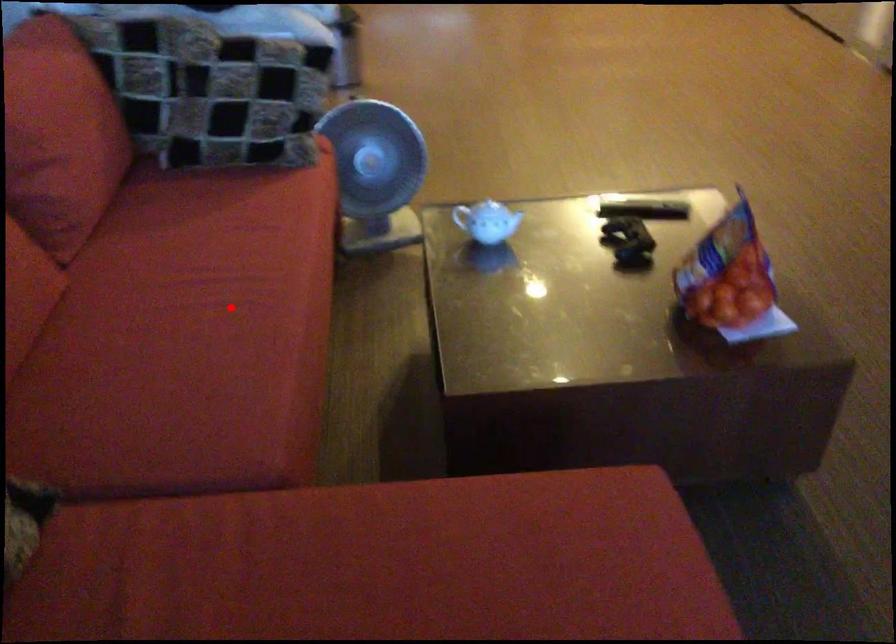
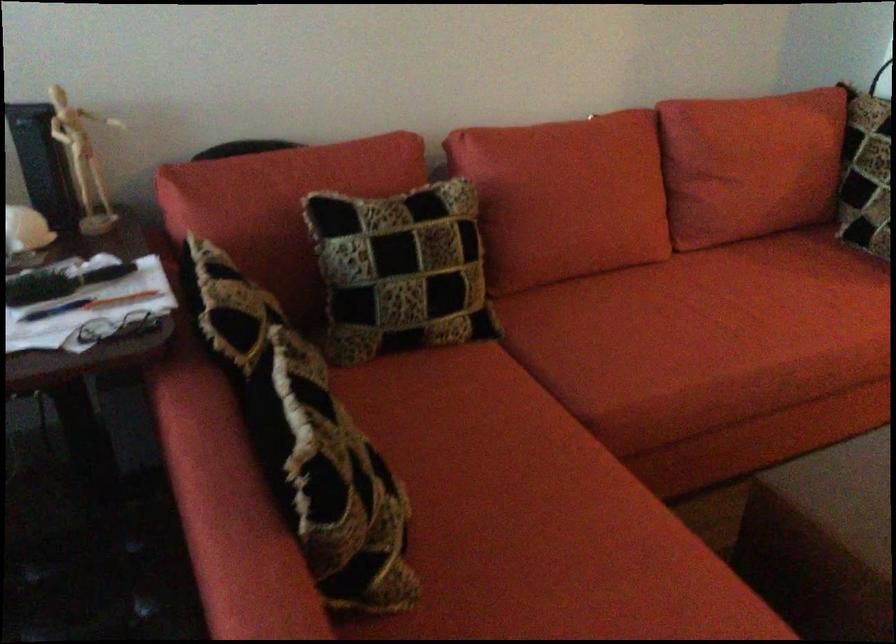
Find the pixel in the second image that matches the highlighted location in the first image.

(726, 323)